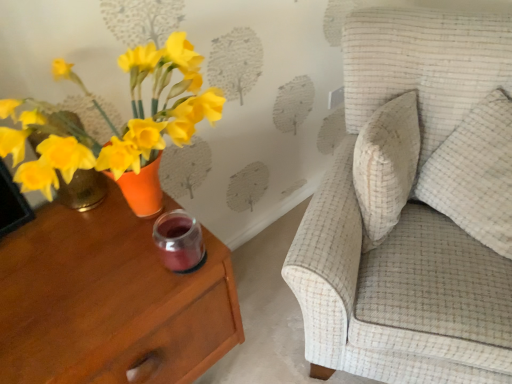
Where is `free point above matte wood nightstand at left (from a real-world perspective)`? free point above matte wood nightstand at left (from a real-world perspective) is located at coordinates (80, 261).